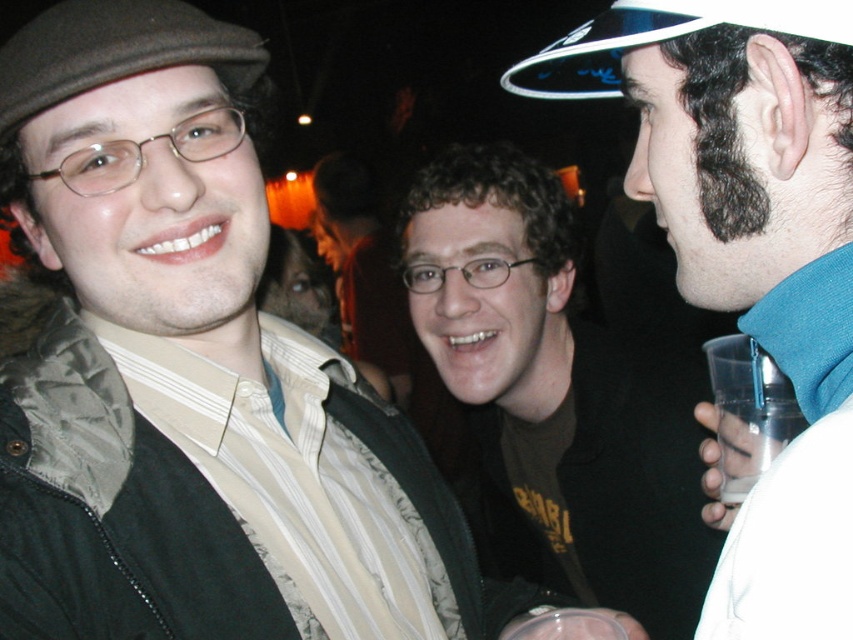
Question: Is the position of matte black jacket at left more distant than that of blue fabric hat at upper right?

Choices:
 (A) no
 (B) yes

Answer: (B)

Question: Which object is the farthest from the matte black jacket at left?

Choices:
 (A) brown felt hat at upper left
 (B) matte black glasses at center

Answer: (B)

Question: Which of the following is the farthest from the observer?

Choices:
 (A) (506, 76)
 (B) (758, 83)
 (C) (131, 13)

Answer: (A)

Question: Does brown felt hat at upper left lie in front of clear plastic cup at lower right?

Choices:
 (A) no
 (B) yes

Answer: (B)

Question: Considering the relative positions of matte black glasses at center and blue fabric hat at upper right in the image provided, where is matte black glasses at center located with respect to blue fabric hat at upper right?

Choices:
 (A) above
 (B) below

Answer: (B)

Question: Which object is farther from the camera taking this photo?

Choices:
 (A) clear plastic cup at lower right
 (B) brown felt hat at upper left

Answer: (A)